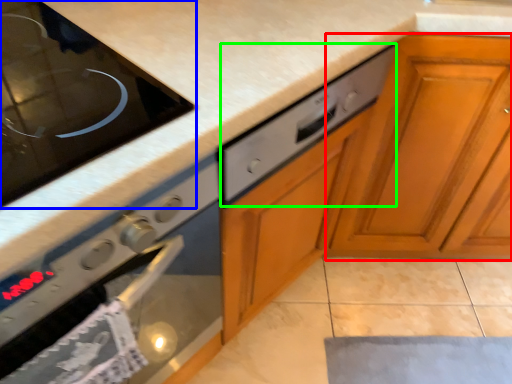
Question: Estimate the real-world distances between objects in this image. Which object is closer to cabinetry (highlighted by a red box), home appliance (highlighted by a blue box) or drawer (highlighted by a green box)?

Choices:
 (A) home appliance
 (B) drawer

Answer: (B)